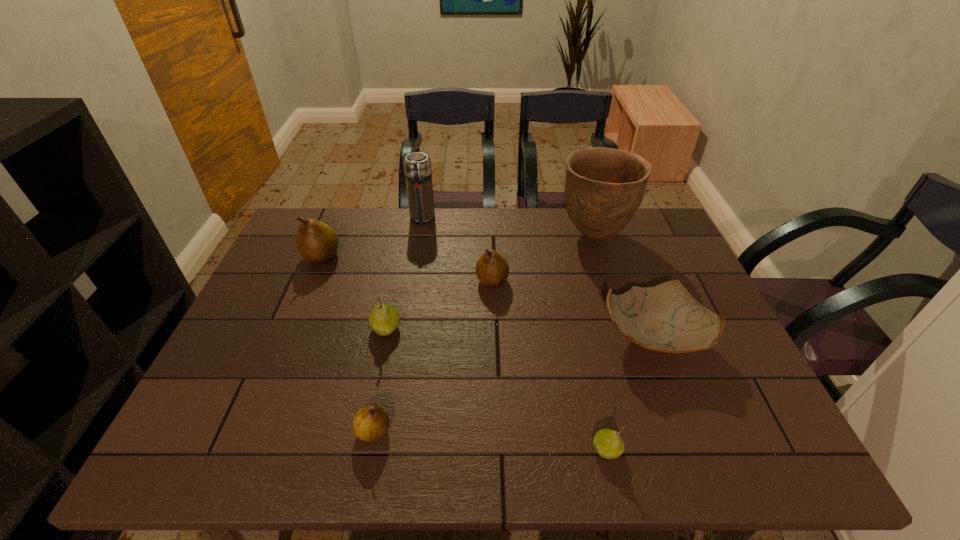
Where is `free space located on the left of the nearer green pear`? Image resolution: width=960 pixels, height=540 pixels. free space located on the left of the nearer green pear is located at coordinates (523, 450).

The height and width of the screenshot is (540, 960). Find the location of `pottery that is at the far edge`. pottery that is at the far edge is located at coordinates (604, 187).

Where is `thermos bottle that is at the far edge`? thermos bottle that is at the far edge is located at coordinates (417, 166).

I want to click on pear situated at the far edge, so click(x=317, y=243).

You are a GUI agent. You are given a task and a screenshot of the screen. Output one action in this format:
    pyautogui.click(x=<x>, y=<y>)
    Task: Click on the object at the left edge
    This screenshot has width=960, height=540.
    Given the screenshot: What is the action you would take?
    pyautogui.click(x=317, y=243)

The width and height of the screenshot is (960, 540). Find the location of `object present at the far left corner`. object present at the far left corner is located at coordinates (317, 243).

Find the location of a particular element. This screenshot has height=540, width=960. object located in the far right corner section of the desktop is located at coordinates (604, 187).

In the image, there is a desktop. Find the location of `blank space at the far edge`. blank space at the far edge is located at coordinates (601, 241).

Find the location of a particular element. Image resolution: width=960 pixels, height=540 pixels. free spot at the near edge of the desktop is located at coordinates (508, 451).

Where is `vacant space at the left edge of the desktop`? The height and width of the screenshot is (540, 960). vacant space at the left edge of the desktop is located at coordinates (291, 309).